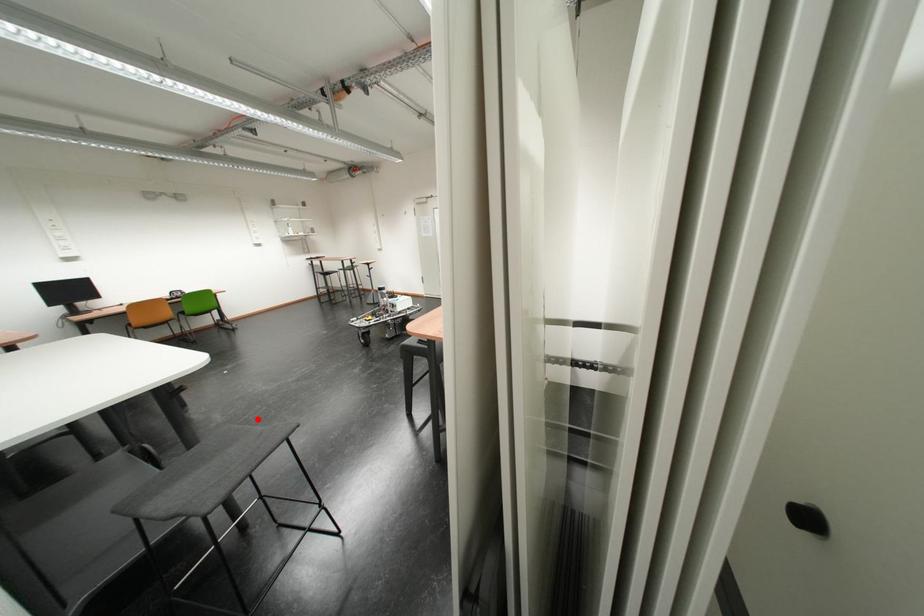
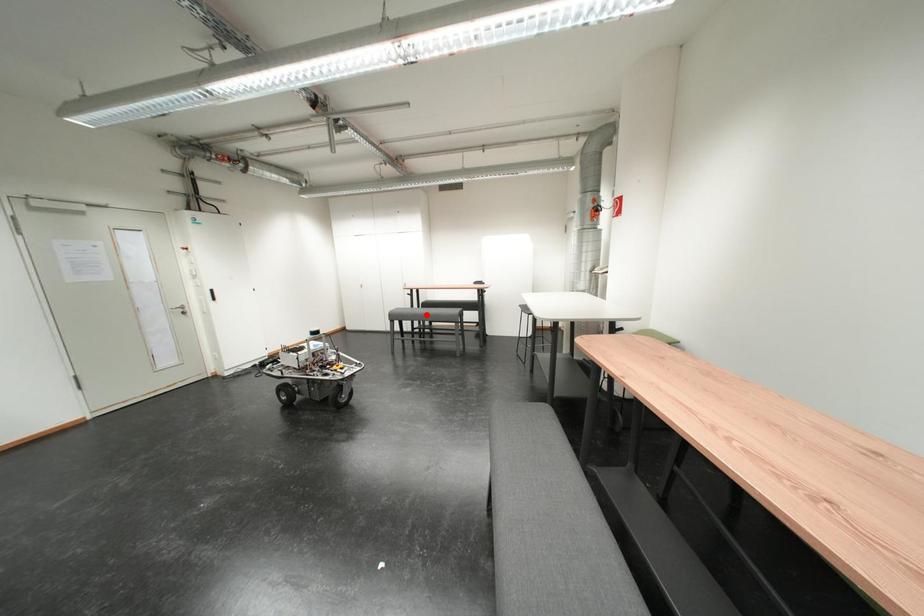
I am providing you with two images of the same scene from different viewpoints. A red point is marked on the first image and another point is marked on the second image. Does the point marked in image1 correspond to the same location as the one in image2?

No